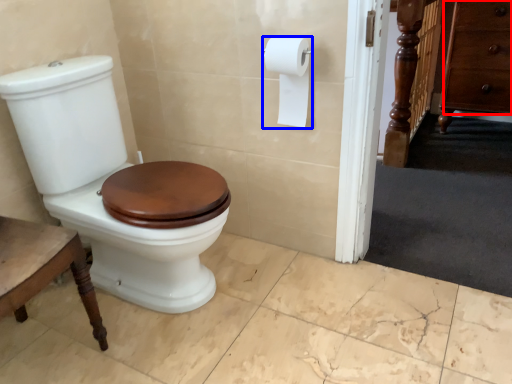
Question: Which point is closer to the camera, drawer (highlighted by a red box) or toilet paper (highlighted by a blue box)?

Choices:
 (A) drawer
 (B) toilet paper

Answer: (B)